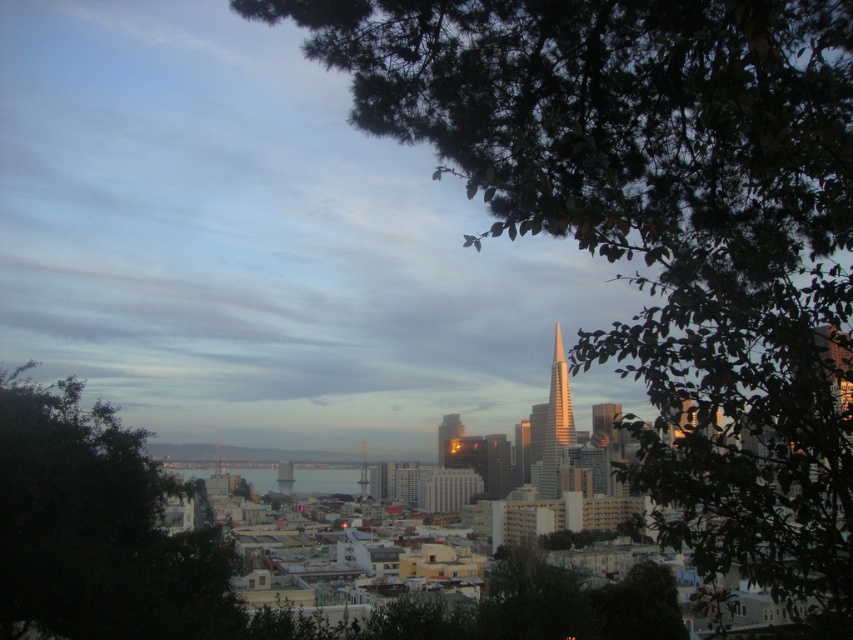
Which is below, green leafy tree at left or shiny glass spire at center?

Positioned lower is green leafy tree at left.

Is green leafy tree at left below shiny glass spire at center?

Indeed, green leafy tree at left is positioned under shiny glass spire at center.

Image resolution: width=853 pixels, height=640 pixels. What do you see at coordinates (97, 529) in the screenshot?
I see `green leafy tree at left` at bounding box center [97, 529].

Locate an element on the screen. green leafy tree at left is located at coordinates (97, 529).

Can you confirm if green leafy tree at upper right is positioned to the left of golden reflective skyscraper at center?

In fact, green leafy tree at upper right is to the right of golden reflective skyscraper at center.

Describe the element at coordinates (663, 227) in the screenshot. This screenshot has width=853, height=640. I see `green leafy tree at upper right` at that location.

Identify the location of green leafy tree at upper right. (x=663, y=227).

Who is more forward, [556,324] or [361,476]?

Point [556,324]

Can you confirm if golden glass skyscraper at center is smaller than shiny glass spire at center?

Actually, golden glass skyscraper at center might be larger than shiny glass spire at center.

Identify the location of golden glass skyscraper at center. This screenshot has width=853, height=640. (552, 422).